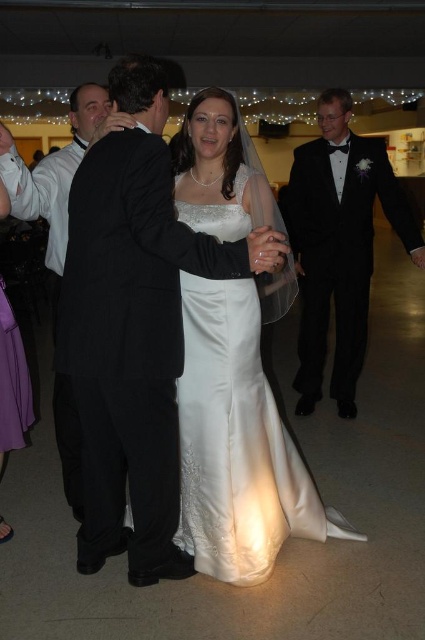
Question: Among these objects, which one is farthest from the camera?

Choices:
 (A) satin/sheer white dress at center
 (B) black satin tuxedo at right
 (C) black pinstripe suit at left

Answer: (B)

Question: Which point appears farthest from the camera in this image?

Choices:
 (A) (246, 445)
 (B) (31, 212)

Answer: (B)

Question: Is black satin tuxedo at right behind black pinstripe suit at left?

Choices:
 (A) no
 (B) yes

Answer: (B)

Question: Is satin/sheer white dress at center wider than black satin tuxedo at right?

Choices:
 (A) yes
 (B) no

Answer: (B)

Question: Considering the real-world distances, which object is farthest from the black satin tuxedo at right?

Choices:
 (A) black pinstripe suit at left
 (B) satin/sheer white dress at center

Answer: (A)

Question: Does satin/sheer white dress at center appear under black pinstripe suit at left?

Choices:
 (A) yes
 (B) no

Answer: (A)